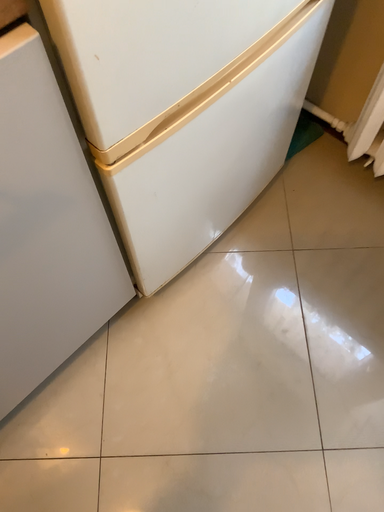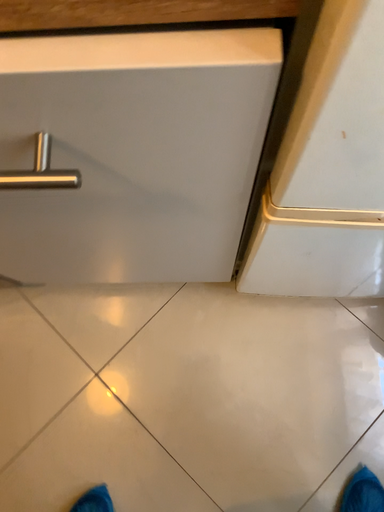
Question: How did the camera likely rotate when shooting the video?

Choices:
 (A) rotated right
 (B) rotated left

Answer: (B)